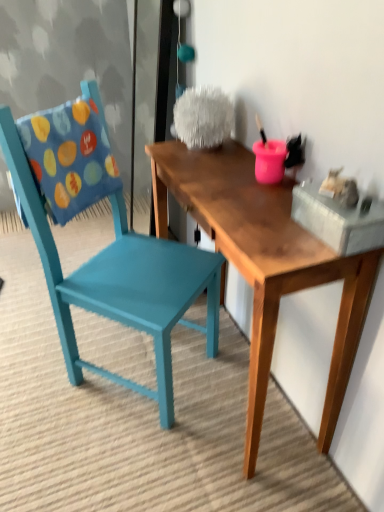
Question: From the image's perspective, is wooden table at center above teal painted wood chair at left?

Choices:
 (A) no
 (B) yes

Answer: (A)

Question: Is wooden table at center to the right of teal painted wood chair at left from the viewer's perspective?

Choices:
 (A) no
 (B) yes

Answer: (B)

Question: Is wooden table at center located outside teal painted wood chair at left?

Choices:
 (A) yes
 (B) no

Answer: (A)

Question: Does wooden table at center lie behind teal painted wood chair at left?

Choices:
 (A) no
 (B) yes

Answer: (A)

Question: Is wooden table at center bigger than teal painted wood chair at left?

Choices:
 (A) no
 (B) yes

Answer: (A)

Question: Relative to wooden table at center, is teal painted wood chair at left in front or behind?

Choices:
 (A) front
 (B) behind

Answer: (B)

Question: From the image's perspective, is teal painted wood chair at left positioned above or below wooden table at center?

Choices:
 (A) above
 (B) below

Answer: (A)

Question: Would you say teal painted wood chair at left is inside or outside wooden table at center?

Choices:
 (A) inside
 (B) outside

Answer: (B)

Question: From a real-world perspective, is teal painted wood chair at left above or below wooden table at center?

Choices:
 (A) below
 (B) above

Answer: (B)

Question: From a real-world perspective, is wooden table at center positioned above or below teal painted wood chair at left?

Choices:
 (A) below
 (B) above

Answer: (A)

Question: Looking at the image, does wooden table at center seem bigger or smaller compared to teal painted wood chair at left?

Choices:
 (A) big
 (B) small

Answer: (B)

Question: Based on their positions, is wooden table at center located to the left or right of teal painted wood chair at left?

Choices:
 (A) right
 (B) left

Answer: (A)

Question: Is point (301, 254) positioned closer to the camera than point (170, 287)?

Choices:
 (A) farther
 (B) closer

Answer: (B)

Question: From their relative heights in the image, would you say teal painted wood chair at left is taller or shorter than blue fabric pillow at left?

Choices:
 (A) short
 (B) tall

Answer: (B)

Question: Does point (77, 120) appear closer or farther from the camera than point (72, 154)?

Choices:
 (A) farther
 (B) closer

Answer: (A)